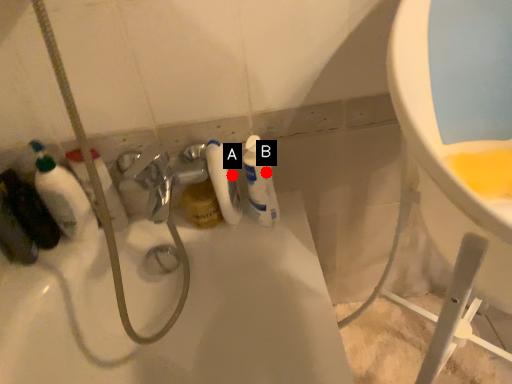
Question: Two points are circled on the image, labeled by A and B beside each circle. Which point is closer to the camera?

Choices:
 (A) A is closer
 (B) B is closer

Answer: (B)